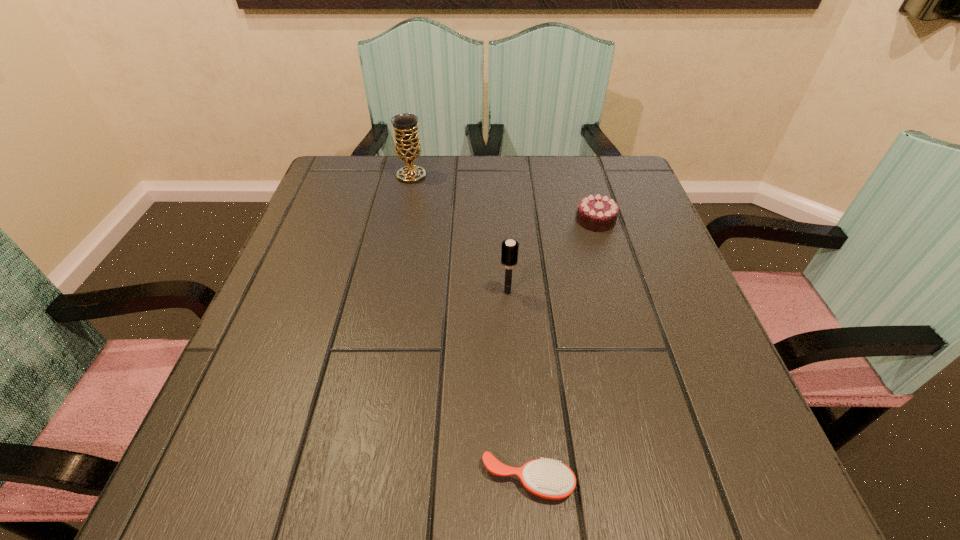
Where is `the tallest object`? The width and height of the screenshot is (960, 540). the tallest object is located at coordinates (407, 145).

Identify the location of the farthest object. This screenshot has height=540, width=960. (407, 145).

This screenshot has width=960, height=540. Find the location of `the taller hairbrush`. the taller hairbrush is located at coordinates (509, 248).

Identify the location of the third shortest object. (509, 248).

In order to click on the rightmost object in this screenshot , I will do `click(598, 213)`.

At what (x,y) coordinates should I click in order to perform the action: click on chocolate cake. Please return your answer as a coordinate pair (x, y). Looking at the image, I should click on (598, 213).

Find the location of a particular element. The width and height of the screenshot is (960, 540). the nearest object is located at coordinates (547, 478).

Locate an element on the screen. the nearer hairbrush is located at coordinates (547, 478).

Find the location of `free spot located 0.150m on the front of the leftmost object`. free spot located 0.150m on the front of the leftmost object is located at coordinates (402, 221).

Identify the location of free space located 0.070m on the right of the third farthest object. This screenshot has width=960, height=540. (552, 292).